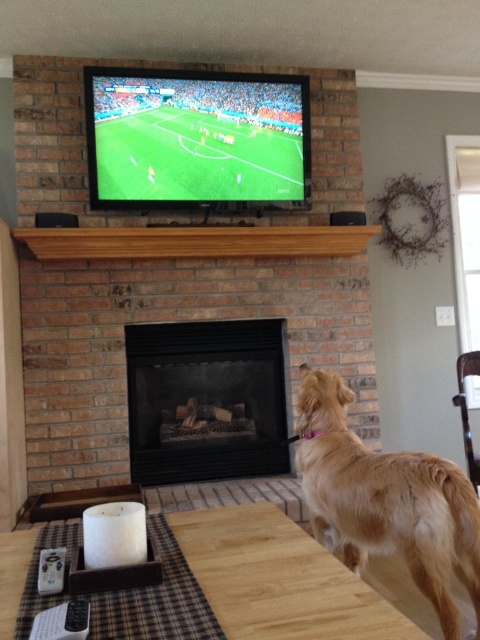
You are standing in the living room facing the fireplace. There is a golden fur dog at lower right. Where is the golden fur dog located relative to the fireplace?

The golden fur dog at lower right is located to the right side of the fireplace, positioned at coordinates approximately 0.783 on the x and 0.804 on the y axis.

You are a guest entering the living room and see the golden fur dog at lower right and the black glass fireplace at center. Which object is closer to the entrance?

The golden fur dog at lower right is closer to the entrance because it is positioned at the lower right, which is typically near entryways in such room layouts.

You are standing in the living room and want to place a small decoration between the two points labeled point (192, 92) and point (52, 564). Which point should the decoration be closer to in order to appear closer to the viewer?

The decoration should be placed closer to point (192, 92) because it is further to the camera than point (52, 564), making it visually closer to the viewer.